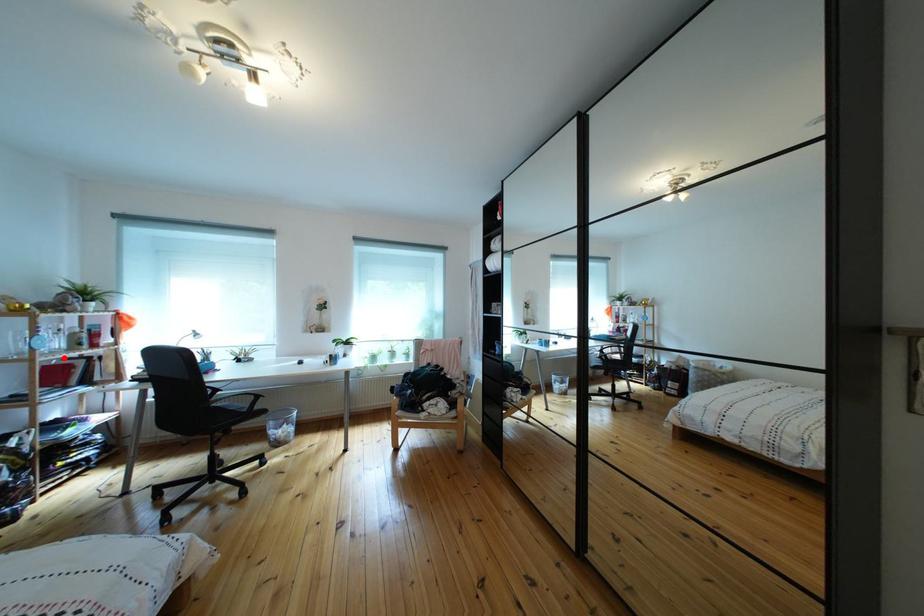
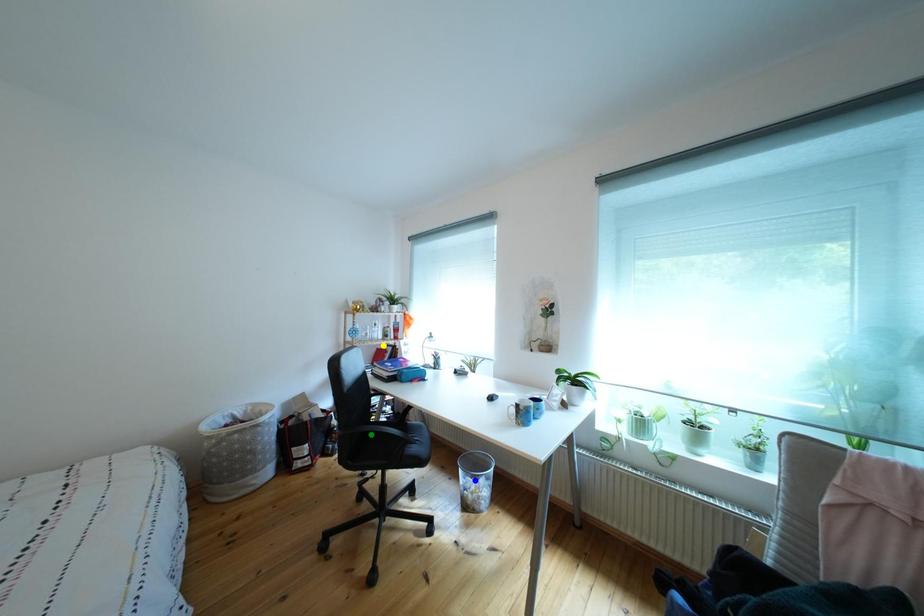
Question: I am providing you with two images of the same scene from different viewpoints. A red point is marked on the first image. You are given multiple points on the second image. Which point in image 2 is actually the same real-world point as the red point in image 1?

Choices:
 (A) yellow point
 (B) green point
 (C) blue point

Answer: (A)